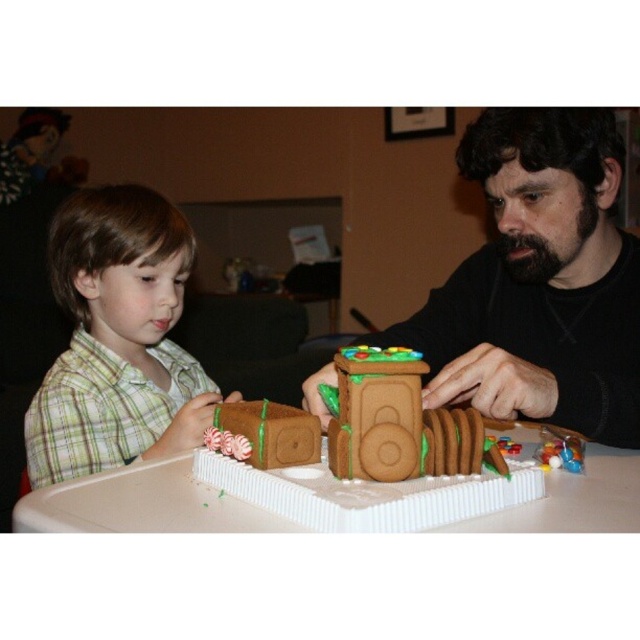
You are standing in front of the gingerbread house and want to place a candy cane on the point that is closer to you. Which point should you choose between point (483,264) and point (241,472)?

Point (241,472) is closer to you than point (483,264), so you should place the candy cane on point (241,472).

You are a guest at a holiday party and want to take a photo of both the black matte gingerbread house at right and the brown sugar cookie train at center. Based on their positions, which one should you focus on first to ensure both are in the frame?

You should focus on the black matte gingerbread house at right first because the brown sugar cookie train at center is behind it, so adjusting the camera to include the front object ensures the one behind is also captured.